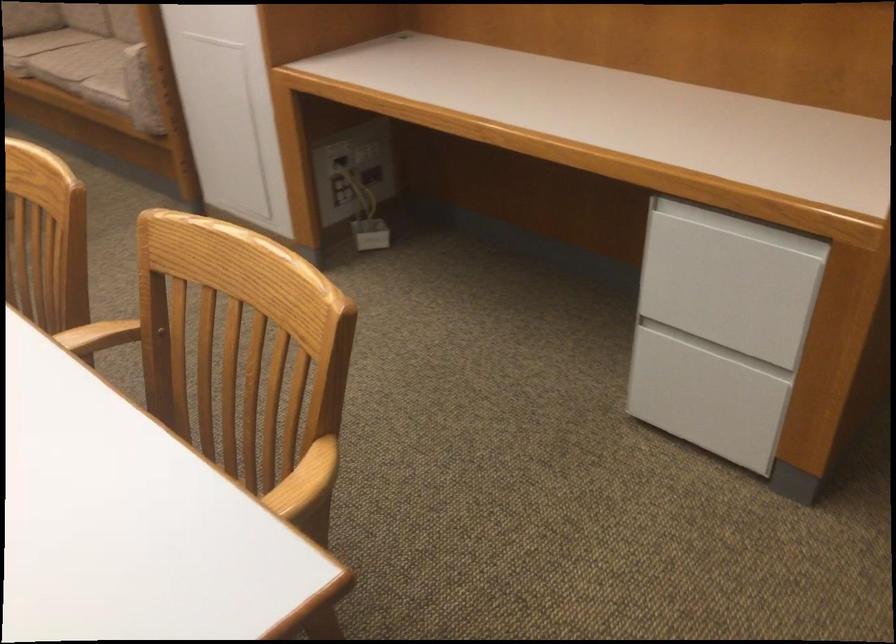
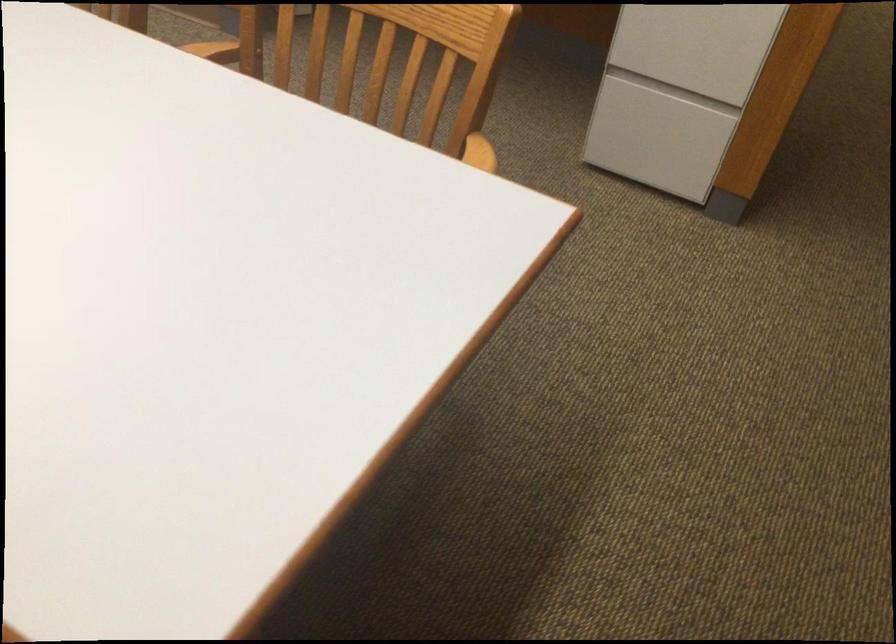
Question: How did the camera likely rotate?

Choices:
 (A) Left
 (B) Right
 (C) Up
 (D) Down

Answer: (B)